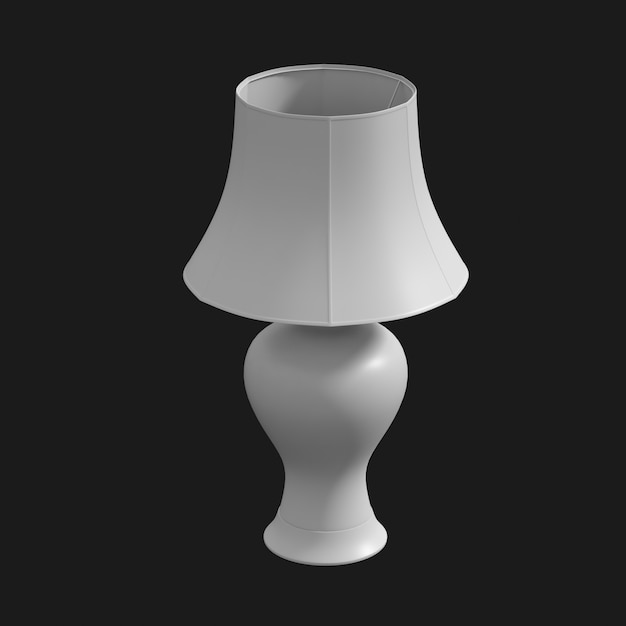
At what (x,y) coordinates should I click in order to perform the action: click on decorative line. Please return your answer as a coordinate pair (x, y). The width and height of the screenshot is (626, 626). Looking at the image, I should click on (330, 529), (285, 520), (364, 521).